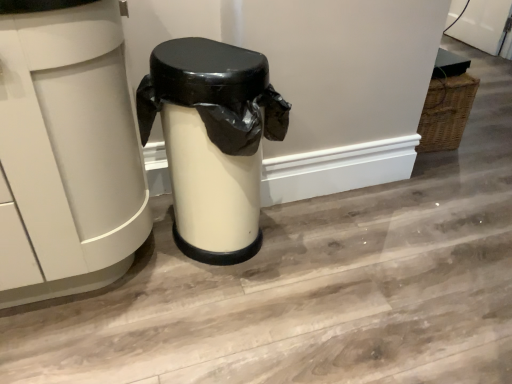
The height and width of the screenshot is (384, 512). What are the coordinates of `white matte trash can at center, which appears as the first waste container when viewed from the left` in the screenshot? It's located at (67, 155).

Measure the distance between white matte trash can at center, acting as the 2th waste container starting from the right, and camera.

white matte trash can at center, acting as the 2th waste container starting from the right, is 32.53 inches away from camera.

What do you see at coordinates (67, 155) in the screenshot? The width and height of the screenshot is (512, 384). I see `white matte trash can at center, which appears as the first waste container when viewed from the left` at bounding box center [67, 155].

Where is `matte white trash can at center, the 2th waste container when ordered from left to right`? This screenshot has height=384, width=512. matte white trash can at center, the 2th waste container when ordered from left to right is located at coordinates (213, 141).

Image resolution: width=512 pixels, height=384 pixels. What do you see at coordinates (213, 141) in the screenshot?
I see `matte white trash can at center, the 2th waste container when ordered from left to right` at bounding box center [213, 141].

The width and height of the screenshot is (512, 384). I want to click on white matte trash can at center, which appears as the first waste container when viewed from the left, so click(67, 155).

Between matte white trash can at center, the 2th waste container when ordered from left to right, and white matte trash can at center, which appears as the first waste container when viewed from the left, which one appears on the right side from the viewer's perspective?

matte white trash can at center, the 2th waste container when ordered from left to right, is more to the right.

Does matte white trash can at center, the 1th waste container from the right, lie behind white matte trash can at center, acting as the 2th waste container starting from the right?

Yes, matte white trash can at center, the 1th waste container from the right, is further from the camera.

Which is nearer, (216,64) or (26,116)?

Point (216,64) appears to be farther away from the viewer than point (26,116).

From the image's perspective, would you say matte white trash can at center, the 2th waste container when ordered from left to right, is positioned over white matte trash can at center, acting as the 2th waste container starting from the right?

Actually, matte white trash can at center, the 2th waste container when ordered from left to right, appears below white matte trash can at center, acting as the 2th waste container starting from the right, in the image.

From a real-world perspective, who is located higher, matte white trash can at center, the 2th waste container when ordered from left to right, or white matte trash can at center, acting as the 2th waste container starting from the right?

From a 3D spatial view, white matte trash can at center, acting as the 2th waste container starting from the right, is above.

Considering the relative sizes of matte white trash can at center, the 2th waste container when ordered from left to right, and white matte trash can at center, which appears as the first waste container when viewed from the left, in the image provided, is matte white trash can at center, the 2th waste container when ordered from left to right, thinner than white matte trash can at center, which appears as the first waste container when viewed from the left,?

Yes, matte white trash can at center, the 2th waste container when ordered from left to right, is thinner than white matte trash can at center, which appears as the first waste container when viewed from the left.

Considering the sizes of objects matte white trash can at center, the 1th waste container from the right, and white matte trash can at center, which appears as the first waste container when viewed from the left, in the image provided, who is shorter, matte white trash can at center, the 1th waste container from the right, or white matte trash can at center, which appears as the first waste container when viewed from the left,?

matte white trash can at center, the 1th waste container from the right, is shorter.

Between matte white trash can at center, the 2th waste container when ordered from left to right, and white matte trash can at center, which appears as the first waste container when viewed from the left, which one has smaller size?

With smaller size is matte white trash can at center, the 2th waste container when ordered from left to right.

Which is correct: matte white trash can at center, the 1th waste container from the right, is inside white matte trash can at center, which appears as the first waste container when viewed from the left, or outside of it?

matte white trash can at center, the 1th waste container from the right, is not enclosed by white matte trash can at center, which appears as the first waste container when viewed from the left.

Can you see matte white trash can at center, the 1th waste container from the right, touching white matte trash can at center, which appears as the first waste container when viewed from the left?

No, matte white trash can at center, the 1th waste container from the right, is not beside white matte trash can at center, which appears as the first waste container when viewed from the left.

Is white matte trash can at center, acting as the 2th waste container starting from the right, at the back of matte white trash can at center, the 2th waste container when ordered from left to right?

No, matte white trash can at center, the 2th waste container when ordered from left to right, is not facing the opposite direction of white matte trash can at center, acting as the 2th waste container starting from the right.

From the picture: How different are the orientations of matte white trash can at center, the 1th waste container from the right, and white matte trash can at center, which appears as the first waste container when viewed from the left, in degrees?

1.61 degrees separate the facing orientations of matte white trash can at center, the 1th waste container from the right, and white matte trash can at center, which appears as the first waste container when viewed from the left.

How distant is matte white trash can at center, the 2th waste container when ordered from left to right, from white matte trash can at center, acting as the 2th waste container starting from the right?

They are 10.54 inches apart.

In the image, there is a matte white trash can at center, the 2th waste container when ordered from left to right. At what (x,y) coordinates should I click in order to perform the action: click on waste container above it (from the image's perspective). Please return your answer as a coordinate pair (x, y). Looking at the image, I should click on (67, 155).

Which object is positioned more to the left, white matte trash can at center, acting as the 2th waste container starting from the right, or matte white trash can at center, the 1th waste container from the right?

Positioned to the left is white matte trash can at center, acting as the 2th waste container starting from the right.

Is white matte trash can at center, acting as the 2th waste container starting from the right, closer to the viewer compared to matte white trash can at center, the 1th waste container from the right?

Yes.

Considering the points (119, 131) and (204, 253), which point is in front, point (119, 131) or point (204, 253)?

The point (119, 131) is closer to the camera.

From the image's perspective, which is below, white matte trash can at center, acting as the 2th waste container starting from the right, or matte white trash can at center, the 1th waste container from the right?

matte white trash can at center, the 1th waste container from the right, is shown below in the image.

From a real-world perspective, which object stands above the other?

white matte trash can at center, which appears as the first waste container when viewed from the left, from a real-world perspective.

Between white matte trash can at center, acting as the 2th waste container starting from the right, and matte white trash can at center, the 1th waste container from the right, which one has larger width?

Wider between the two is white matte trash can at center, acting as the 2th waste container starting from the right.

Looking at this image, considering the sizes of objects white matte trash can at center, acting as the 2th waste container starting from the right, and matte white trash can at center, the 2th waste container when ordered from left to right, in the image provided, who is taller, white matte trash can at center, acting as the 2th waste container starting from the right, or matte white trash can at center, the 2th waste container when ordered from left to right,?

Standing taller between the two is white matte trash can at center, acting as the 2th waste container starting from the right.

Between white matte trash can at center, which appears as the first waste container when viewed from the left, and matte white trash can at center, the 1th waste container from the right, which one has smaller size?

Smaller between the two is matte white trash can at center, the 1th waste container from the right.

Would you say white matte trash can at center, which appears as the first waste container when viewed from the left, contains matte white trash can at center, the 2th waste container when ordered from left to right?

No, white matte trash can at center, which appears as the first waste container when viewed from the left, does not contain matte white trash can at center, the 2th waste container when ordered from left to right.

Are white matte trash can at center, which appears as the first waste container when viewed from the left, and matte white trash can at center, the 1th waste container from the right, located far from each other?

white matte trash can at center, which appears as the first waste container when viewed from the left, is near matte white trash can at center, the 1th waste container from the right, not far away.

Is white matte trash can at center, acting as the 2th waste container starting from the right, facing towards matte white trash can at center, the 1th waste container from the right?

No, white matte trash can at center, acting as the 2th waste container starting from the right, does not turn towards matte white trash can at center, the 1th waste container from the right.

Can you tell me how much white matte trash can at center, which appears as the first waste container when viewed from the left, and matte white trash can at center, the 2th waste container when ordered from left to right, differ in facing direction?

There is a 1.61-degree angle between the facing directions of white matte trash can at center, which appears as the first waste container when viewed from the left, and matte white trash can at center, the 2th waste container when ordered from left to right.

Find the location of `waste container that is on the left side of matte white trash can at center, the 2th waste container when ordered from left to right`. waste container that is on the left side of matte white trash can at center, the 2th waste container when ordered from left to right is located at coordinates (67, 155).

Where is `waste container located in front of the matte white trash can at center, the 2th waste container when ordered from left to right`? waste container located in front of the matte white trash can at center, the 2th waste container when ordered from left to right is located at coordinates (67, 155).

Locate an element on the screen. This screenshot has height=384, width=512. waste container directly beneath the white matte trash can at center, which appears as the first waste container when viewed from the left (from a real-world perspective) is located at coordinates (213, 141).